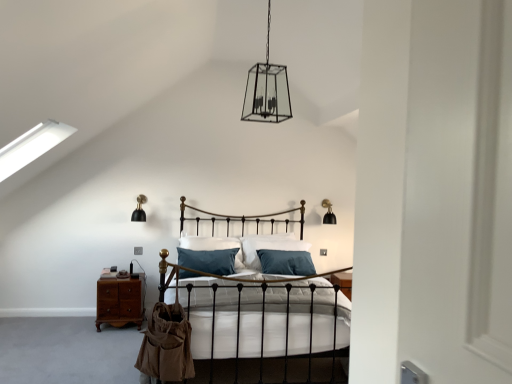
Find the location of a particular element. This screenshot has height=384, width=512. black matte wall sconce at upper right, acting as the third light fixture starting from the front is located at coordinates (328, 213).

This screenshot has width=512, height=384. Describe the element at coordinates (328, 213) in the screenshot. I see `black matte wall sconce at upper right, acting as the third light fixture starting from the front` at that location.

Describe the element at coordinates (120, 299) in the screenshot. I see `mahogany wood nightstand at lower left` at that location.

Describe the element at coordinates (139, 210) in the screenshot. The image size is (512, 384). I see `black matte wall sconce at left, the second light fixture in the front-to-back sequence` at that location.

Describe the element at coordinates (256, 300) in the screenshot. I see `matte black bed at center` at that location.

Where is `black matte wall sconce at upper right, the third light fixture viewed from the top`? black matte wall sconce at upper right, the third light fixture viewed from the top is located at coordinates (328, 213).

Between black matte wall sconce at left, arranged as the second light fixture when viewed from the back, and matte black bed at center, which one appears on the left side from the viewer's perspective?

From the viewer's perspective, black matte wall sconce at left, arranged as the second light fixture when viewed from the back, appears more on the left side.

Are black matte wall sconce at left, arranged as the second light fixture when viewed from the back, and matte black bed at center far apart?

Yes, black matte wall sconce at left, arranged as the second light fixture when viewed from the back, and matte black bed at center are quite far apart.

From a real-world perspective, is black matte wall sconce at left, the second light fixture in the front-to-back sequence, physically below matte black bed at center?

No.

Considering the sizes of objects teal fabric pillow at center and clear glass lantern at center, placed as the third light fixture when sorted from back to front, in the image provided, who is wider, teal fabric pillow at center or clear glass lantern at center, placed as the third light fixture when sorted from back to front,?

clear glass lantern at center, placed as the third light fixture when sorted from back to front.

From a real-world perspective, which is physically below, teal fabric pillow at center or clear glass lantern at center, placed as the 1th light fixture when sorted from top to bottom?

In real-world perspective, teal fabric pillow at center is lower.

How much distance is there between teal fabric pillow at center and clear glass lantern at center, which is the 2th light fixture in left-to-right order?

teal fabric pillow at center is 2.08 meters away from clear glass lantern at center, which is the 2th light fixture in left-to-right order.

Visually, is teal fabric pillow at center positioned to the left or to the right of clear glass lantern at center, the 3th light fixture ordered from the bottom?

In the image, teal fabric pillow at center appears on the left side of clear glass lantern at center, the 3th light fixture ordered from the bottom.

From a real-world perspective, between mahogany wood nightstand at lower left and clear glass lantern at center, which is the first light fixture from front to back, who is vertically higher?

From a 3D spatial view, clear glass lantern at center, which is the first light fixture from front to back, is above.

Is point (119, 287) closer or farther from the camera than point (259, 108)?

Point (119, 287).

Considering the sizes of objects mahogany wood nightstand at lower left and clear glass lantern at center, placed as the third light fixture when sorted from back to front, in the image provided, who is shorter, mahogany wood nightstand at lower left or clear glass lantern at center, placed as the third light fixture when sorted from back to front,?

mahogany wood nightstand at lower left is shorter.

From the image's perspective, between mahogany wood nightstand at lower left and clear glass lantern at center, acting as the second light fixture starting from the right, which one is located above?

From the image's view, clear glass lantern at center, acting as the second light fixture starting from the right, is above.

Does mahogany wood nightstand at lower left have a smaller size compared to black matte wall sconce at left, acting as the 1th light fixture starting from the left?

No, mahogany wood nightstand at lower left is not smaller than black matte wall sconce at left, acting as the 1th light fixture starting from the left.

Is the depth of mahogany wood nightstand at lower left greater than that of black matte wall sconce at left, acting as the second light fixture starting from the top?

No, mahogany wood nightstand at lower left is closer to the viewer.

From the picture: Do you think mahogany wood nightstand at lower left is within black matte wall sconce at left, acting as the 1th light fixture starting from the left, or outside of it?

mahogany wood nightstand at lower left is outside black matte wall sconce at left, acting as the 1th light fixture starting from the left.

Between mahogany wood nightstand at lower left and black matte wall sconce at left, positioned as the 2th light fixture in bottom-to-top order, which one has less height?

Standing shorter between the two is black matte wall sconce at left, positioned as the 2th light fixture in bottom-to-top order.

Is matte black bed at center to the right of clear glass lantern at center, the 3th light fixture ordered from the bottom, from the viewer's perspective?

In fact, matte black bed at center is to the left of clear glass lantern at center, the 3th light fixture ordered from the bottom.

Is point (281, 345) less distant than point (280, 69)?

Yes, it is in front of point (280, 69).

How different are the orientations of matte black bed at center and clear glass lantern at center, acting as the second light fixture starting from the right, in degrees?

The angle between the facing direction of matte black bed at center and the facing direction of clear glass lantern at center, acting as the second light fixture starting from the right, is 3.72 degrees.

In terms of height, does matte black bed at center look taller or shorter compared to clear glass lantern at center, placed as the third light fixture when sorted from back to front?

matte black bed at center is shorter than clear glass lantern at center, placed as the third light fixture when sorted from back to front.

Does point (135, 220) lie behind point (331, 219)?

No.

Is black matte wall sconce at left, the 3th light fixture from the right, bigger than black matte wall sconce at upper right, acting as the third light fixture starting from the front?

Yes.

Is black matte wall sconce at left, acting as the 1th light fixture starting from the left, not within black matte wall sconce at upper right, acting as the third light fixture starting from the front?

black matte wall sconce at left, acting as the 1th light fixture starting from the left, lies outside black matte wall sconce at upper right, acting as the third light fixture starting from the front,'s area.

Considering the relative sizes of black matte wall sconce at left, positioned as the 2th light fixture in bottom-to-top order, and black matte wall sconce at upper right, the third light fixture viewed from the top, in the image provided, is black matte wall sconce at left, positioned as the 2th light fixture in bottom-to-top order, thinner than black matte wall sconce at upper right, the third light fixture viewed from the top,?

Yes, black matte wall sconce at left, positioned as the 2th light fixture in bottom-to-top order, is thinner than black matte wall sconce at upper right, the third light fixture viewed from the top.

What's the angular difference between teal fabric pillow at center and matte black bed at center's facing directions?

4.38 degrees.

From a real-world perspective, who is located higher, teal fabric pillow at center or matte black bed at center?

teal fabric pillow at center, from a real-world perspective.

I want to click on bed located in front of the teal fabric pillow at center, so click(x=256, y=300).

Visually, is teal fabric pillow at center positioned to the left or to the right of matte black bed at center?

teal fabric pillow at center is positioned on matte black bed at center's left side.

This screenshot has width=512, height=384. Identify the location of light fixture on the left side of matte black bed at center. (139, 210).

Image resolution: width=512 pixels, height=384 pixels. What are the coordinates of `light fixture that is the 3rd one when counting upward from the teal fabric pillow at center (from the image's perspective)` in the screenshot? It's located at (267, 90).

Which object lies nearer to the anchor point clear glass lantern at center, the 3th light fixture ordered from the bottom, mahogany wood nightstand at lower left or matte black bed at center?

Based on the image, matte black bed at center appears to be nearer to clear glass lantern at center, the 3th light fixture ordered from the bottom.

When comparing their distances from clear glass lantern at center, acting as the second light fixture starting from the right, does black matte wall sconce at upper right, which ranks as the 1th light fixture in back-to-front order, or mahogany wood nightstand at lower left seem further?

mahogany wood nightstand at lower left.

From the image, which object appears to be farther from mahogany wood nightstand at lower left, clear glass lantern at center, acting as the second light fixture starting from the right, or black matte wall sconce at upper right, marked as the third light fixture in a left-to-right arrangement?

Based on the image, clear glass lantern at center, acting as the second light fixture starting from the right, appears to be further to mahogany wood nightstand at lower left.

From the image, which object appears to be farther from teal fabric pillow at center, mahogany wood nightstand at lower left or matte black bed at center?

matte black bed at center lies further to teal fabric pillow at center than the other object.

When comparing their distances from mahogany wood nightstand at lower left, does clear glass lantern at center, placed as the 1th light fixture when sorted from top to bottom, or teal fabric pillow at center seem closer?

teal fabric pillow at center.

Estimate the real-world distances between objects in this image. Which object is further from black matte wall sconce at upper right, acting as the third light fixture starting from the front, matte black bed at center or mahogany wood nightstand at lower left?

mahogany wood nightstand at lower left is positioned further to the anchor black matte wall sconce at upper right, acting as the third light fixture starting from the front.

When comparing their distances from matte black bed at center, does clear glass lantern at center, which is the 2th light fixture in left-to-right order, or black matte wall sconce at upper right, marked as the third light fixture in a left-to-right arrangement, seem closer?

clear glass lantern at center, which is the 2th light fixture in left-to-right order, lies closer to matte black bed at center than the other object.

Considering their positions, is matte black bed at center positioned further to black matte wall sconce at left, the 3th light fixture from the right, than teal fabric pillow at center?

Based on the image, matte black bed at center appears to be further to black matte wall sconce at left, the 3th light fixture from the right.

The width and height of the screenshot is (512, 384). What are the coordinates of `pillow located between clear glass lantern at center, acting as the second light fixture starting from the right, and black matte wall sconce at left, positioned as the 2th light fixture in bottom-to-top order, in the depth direction` in the screenshot? It's located at (214, 246).

Where is `pillow between clear glass lantern at center, the 3th light fixture ordered from the bottom, and black matte wall sconce at upper right, which ranks as the 1th light fixture in back-to-front order, along the z-axis`? Image resolution: width=512 pixels, height=384 pixels. pillow between clear glass lantern at center, the 3th light fixture ordered from the bottom, and black matte wall sconce at upper right, which ranks as the 1th light fixture in back-to-front order, along the z-axis is located at coordinates (214, 246).

The width and height of the screenshot is (512, 384). I want to click on bed situated between black matte wall sconce at left, arranged as the second light fixture when viewed from the back, and black matte wall sconce at upper right, the third light fixture viewed from the top, from left to right, so pyautogui.click(x=256, y=300).

Where is `light fixture located between clear glass lantern at center, acting as the second light fixture starting from the right, and black matte wall sconce at upper right, which ranks as the 1th light fixture in back-to-front order, in the depth direction`? The width and height of the screenshot is (512, 384). light fixture located between clear glass lantern at center, acting as the second light fixture starting from the right, and black matte wall sconce at upper right, which ranks as the 1th light fixture in back-to-front order, in the depth direction is located at coordinates click(x=139, y=210).